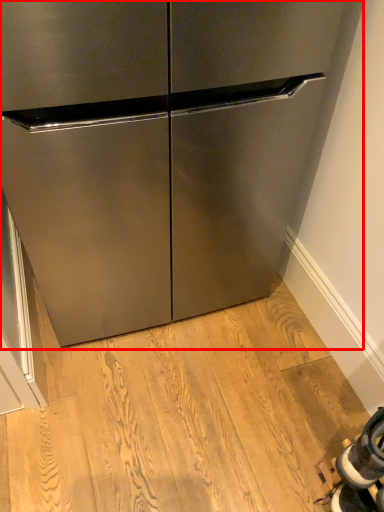
Question: From the image's perspective, where is cabinetry (annotated by the red box) located relative to shoe?

Choices:
 (A) below
 (B) above

Answer: (B)